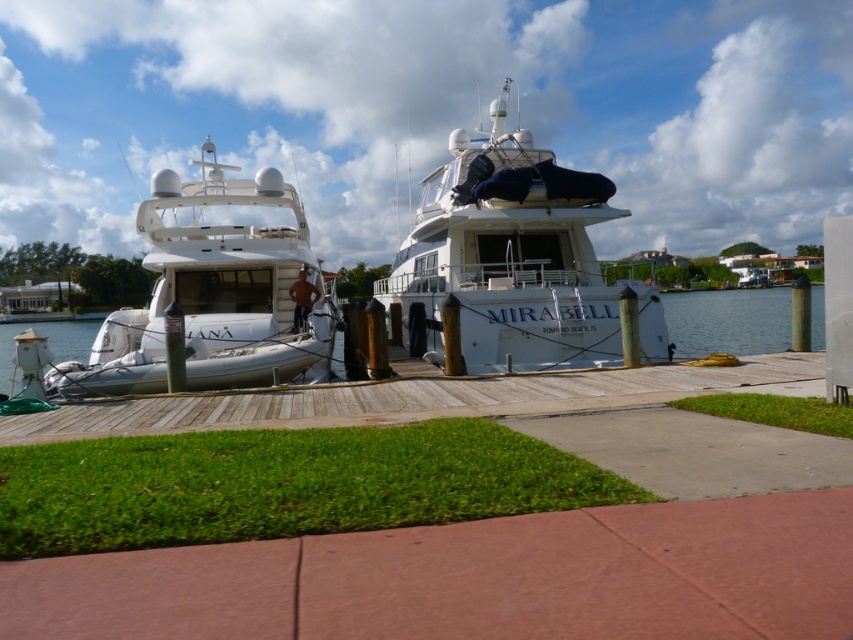
You are a delivery person with a cart that is 4 meters wide. You need to move your cart between the white glossy yacht at center and the wooden dock at center. Can you fit your cart through the space between them?

The distance between the white glossy yacht at center and the wooden dock at center is 5.02 meters, so yes, the cart can fit through since it is wider than the cart.

You are standing on the dock and see the point marked at coordinates (213, 292). What object is located at that point?

The point at coordinates (213, 292) marks the white glossy yacht at center.